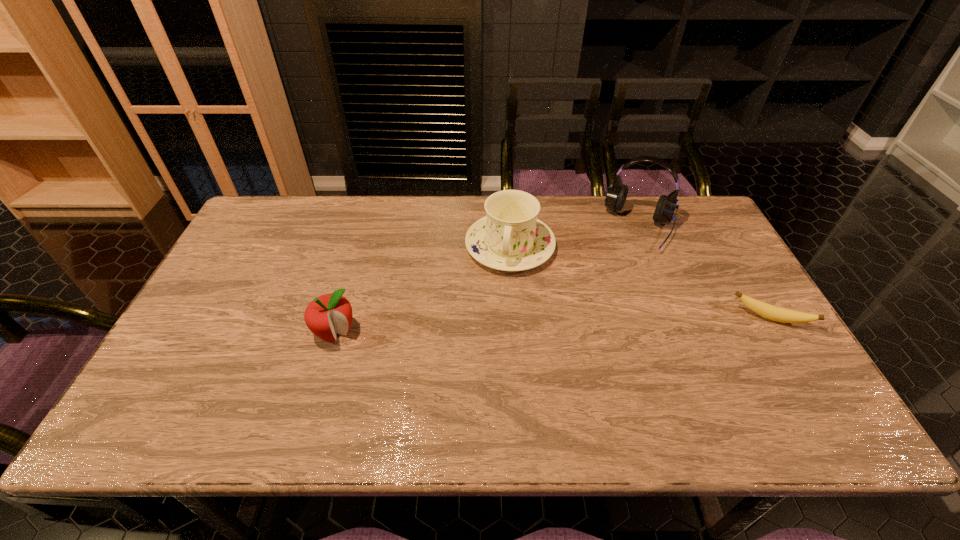
Locate an element on the screen. The image size is (960, 540). free point between the shortest object and the apple is located at coordinates (553, 325).

Where is `free area in between the chinaware and the tallest object`? This screenshot has height=540, width=960. free area in between the chinaware and the tallest object is located at coordinates (575, 237).

This screenshot has width=960, height=540. I want to click on free area in between the third object from right to left and the shortest object, so click(x=640, y=282).

Identify which object is the second closest to the headset. Please provide its 2D coordinates. Your answer should be formatted as a tuple, i.e. [(x, y)], where the tuple contains the x and y coordinates of a point satisfying the conditions above.

[(784, 315)]

Identify which object is the second closest to the chinaware. Please provide its 2D coordinates. Your answer should be formatted as a tuple, i.e. [(x, y)], where the tuple contains the x and y coordinates of a point satisfying the conditions above.

[(329, 314)]

This screenshot has height=540, width=960. Identify the location of free space that satisfies the following two spatial constraints: 1. on the front side of the second object from right to left; 2. on the left side of the banana. click(x=679, y=318).

Find the location of `vacant region that satisfies the following two spatial constraints: 1. on the front side of the chinaware; 2. on the right side of the shortest object`. vacant region that satisfies the following two spatial constraints: 1. on the front side of the chinaware; 2. on the right side of the shortest object is located at coordinates (516, 318).

The width and height of the screenshot is (960, 540). What are the coordinates of `vacant space that satisfies the following two spatial constraints: 1. on the back side of the leftmost object; 2. on the right side of the tallest object` in the screenshot? It's located at (366, 227).